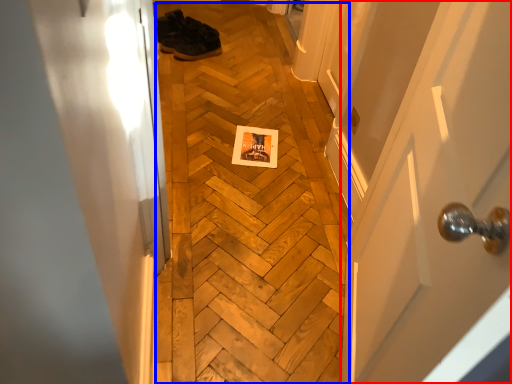
Question: Which of the following is the closest to the observer, door (highlighted by a red box) or plywood (highlighted by a blue box)?

Choices:
 (A) door
 (B) plywood

Answer: (A)